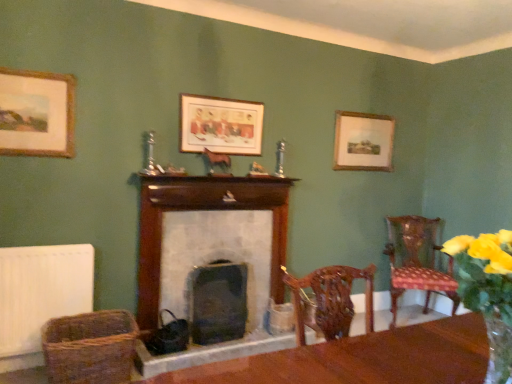
Question: Is yellow fabric flower at right bigger than woven brown basket at lower left?

Choices:
 (A) no
 (B) yes

Answer: (A)

Question: Is the depth of yellow fabric flower at right less than that of woven brown basket at lower left?

Choices:
 (A) yes
 (B) no

Answer: (A)

Question: Is yellow fabric flower at right oriented towards woven brown basket at lower left?

Choices:
 (A) no
 (B) yes

Answer: (A)

Question: Is yellow fabric flower at right not close to woven brown basket at lower left?

Choices:
 (A) no
 (B) yes

Answer: (B)

Question: Does yellow fabric flower at right come behind woven brown basket at lower left?

Choices:
 (A) yes
 (B) no

Answer: (B)

Question: Considering the relative positions of polka dot fabric chair at right and yellow fabric flower at right in the image provided, is polka dot fabric chair at right to the left or to the right of yellow fabric flower at right?

Choices:
 (A) left
 (B) right

Answer: (B)

Question: Is polka dot fabric chair at right inside or outside of yellow fabric flower at right?

Choices:
 (A) outside
 (B) inside

Answer: (A)

Question: Considering the positions of point (410, 238) and point (489, 296), is point (410, 238) closer or farther from the camera than point (489, 296)?

Choices:
 (A) closer
 (B) farther

Answer: (B)

Question: Considering the positions of polka dot fabric chair at right and yellow fabric flower at right in the image, is polka dot fabric chair at right taller or shorter than yellow fabric flower at right?

Choices:
 (A) short
 (B) tall

Answer: (B)

Question: In the image, is white matte radiator at lower left on the left side or the right side of black stone fireplace at center, placed as the 2th fireplace when sorted from top to bottom?

Choices:
 (A) left
 (B) right

Answer: (A)

Question: In terms of height, does white matte radiator at lower left look taller or shorter compared to black stone fireplace at center, which is the 1th fireplace in bottom-to-top order?

Choices:
 (A) tall
 (B) short

Answer: (A)

Question: Which is correct: white matte radiator at lower left is inside black stone fireplace at center, which is the 1th fireplace in bottom-to-top order, or outside of it?

Choices:
 (A) outside
 (B) inside

Answer: (A)

Question: Considering their positions, is white matte radiator at lower left located in front of or behind black stone fireplace at center, placed as the 2th fireplace when sorted from top to bottom?

Choices:
 (A) front
 (B) behind

Answer: (A)

Question: Considering their positions, is black stone fireplace at center, which is the 1th fireplace in bottom-to-top order, located in front of or behind yellow fabric flower at right?

Choices:
 (A) front
 (B) behind

Answer: (B)

Question: Based on their sizes in the image, would you say black stone fireplace at center, placed as the 2th fireplace when sorted from top to bottom, is bigger or smaller than yellow fabric flower at right?

Choices:
 (A) big
 (B) small

Answer: (A)